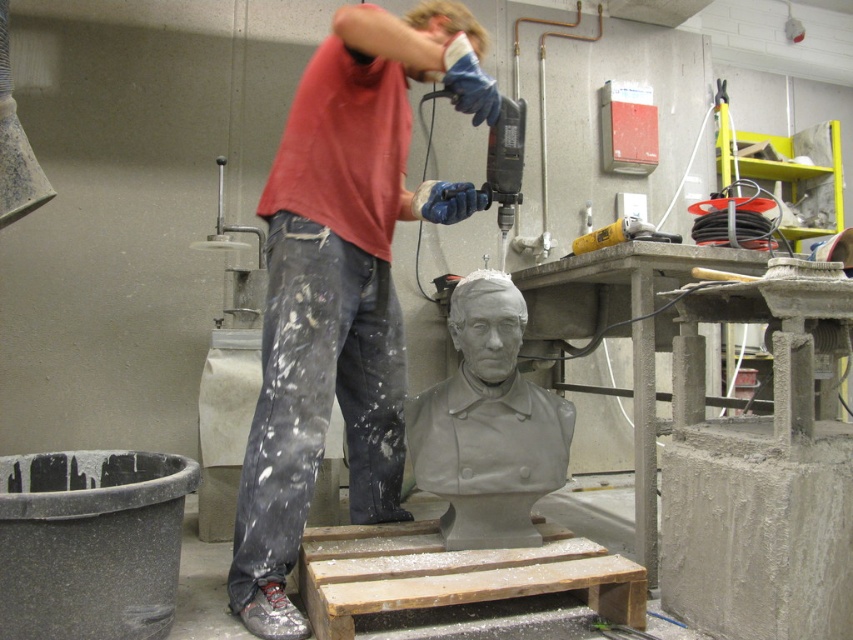
In the scene shown: Between matte gray bust at center and gray matte bust at center, which one appears on the right side from the viewer's perspective?

gray matte bust at center is more to the right.

Is matte gray bust at center above gray matte bust at center?

Indeed, matte gray bust at center is positioned over gray matte bust at center.

Locate an element on the screen. This screenshot has width=853, height=640. matte gray bust at center is located at coordinates (341, 284).

Can you confirm if matte gray bust at center is positioned above yellow plastic drill at upper center?

Incorrect, matte gray bust at center is not positioned above yellow plastic drill at upper center.

Between point (299, 500) and point (612, 228), which one is positioned behind?

The point (612, 228) is more distant.

Between point (264, 492) and point (642, 230), which one is positioned in front?

Point (264, 492)

The height and width of the screenshot is (640, 853). I want to click on matte gray bust at center, so click(x=341, y=284).

Can you confirm if gray matte bust at center is positioned above yellow plastic drill at upper center?

Actually, gray matte bust at center is below yellow plastic drill at upper center.

Does point (467, 346) come behind point (637, 232)?

That is False.

Find the location of `gray matte bust at center`. gray matte bust at center is located at coordinates (488, 424).

Find the location of a particular element. This screenshot has height=640, width=853. gray matte bust at center is located at coordinates (488, 424).